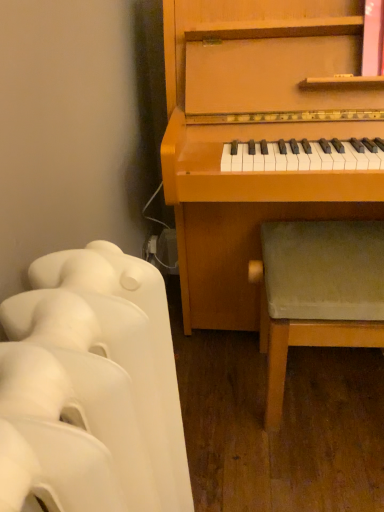
Locate an element on the screen. This screenshot has width=384, height=512. free point above green fabric stool at lower right (from a real-world perspective) is located at coordinates (337, 248).